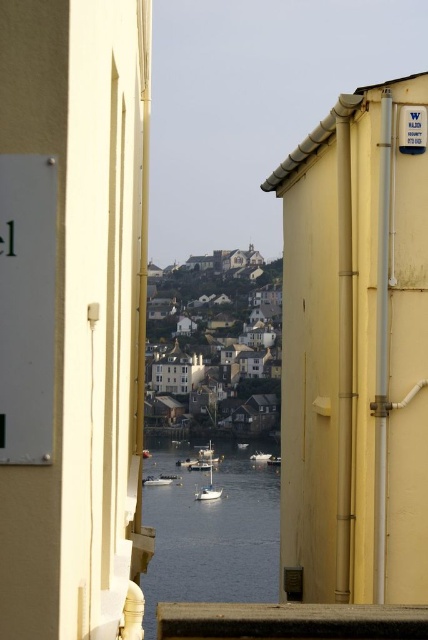
You are standing at the entrance of the narrow passageway between the two beige walls. You want to take a photo of the white glossy boat at center from the best possible angle. Considering the boat is located at coordinates 0.752 on the x and 0.371 on the y axis, where should you position yourself to capture it perfectly?

The white glossy boat at center is located at coordinates 0.752 on the x and 0.371 on the y axis. To capture it perfectly, position yourself directly in front of the boat along the central axis of the narrow passageway, aligning your camera with the boat to ensure it is centered in the frame.

In the scene shown: You are a photographer standing at the entrance of the coastal passageway. You want to capture a photo where both the smooth water at center and the white glossy sailboat at center are clearly visible. Based on their heights, which object will appear taller in the photo?

The smooth water at center will appear taller in the photo since it has a greater height compared to the white glossy sailboat at center according to the description.

You are standing at the entrance of the narrow passageway between the two beige walls. You see a point marked at coordinates (x=211, y=532). Where is this point located in the scene?

The point is on smooth water at center.